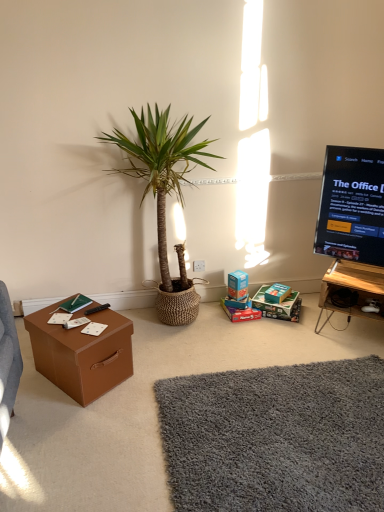
Find the location of `vacant space to the left of matte brown storage box at lower right, the 3th storage box from the left`. vacant space to the left of matte brown storage box at lower right, the 3th storage box from the left is located at coordinates (259, 296).